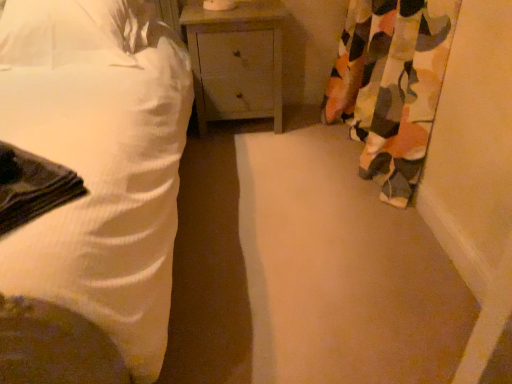
Question: Relative to camouflage fabric curtain at right, is white textured bed at left in front or behind?

Choices:
 (A) behind
 (B) front

Answer: (B)

Question: From a real-world perspective, is white textured bed at left positioned above or below camouflage fabric curtain at right?

Choices:
 (A) below
 (B) above

Answer: (B)

Question: Based on their relative distances, which object is farther from the white textured bed at left?

Choices:
 (A) white fabric pillow at upper left
 (B) camouflage fabric curtain at right
 (C) matte gray nightstand at center

Answer: (B)

Question: Estimate the real-world distances between objects in this image. Which object is farther from the matte gray nightstand at center?

Choices:
 (A) white fabric pillow at upper left
 (B) white textured bed at left
 (C) camouflage fabric curtain at right

Answer: (B)